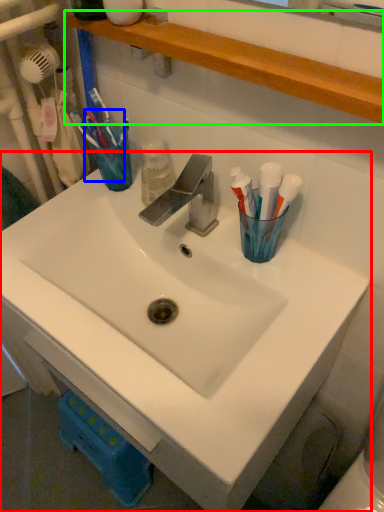
Question: Which is farther away from sink (highlighted by a red box)? toothbrush (highlighted by a blue box) or shelve (highlighted by a green box)?

Choices:
 (A) toothbrush
 (B) shelve

Answer: (B)